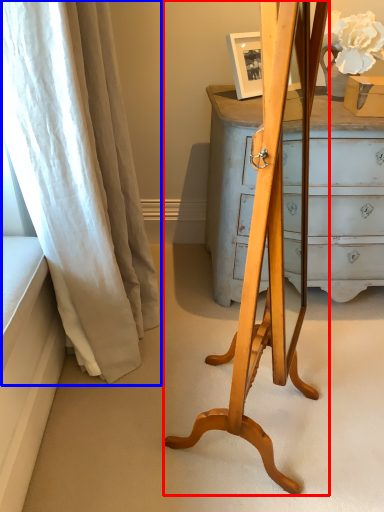
Question: Which object appears farthest to the camera in this image, easel (highlighted by a red box) or curtain (highlighted by a blue box)?

Choices:
 (A) easel
 (B) curtain

Answer: (B)